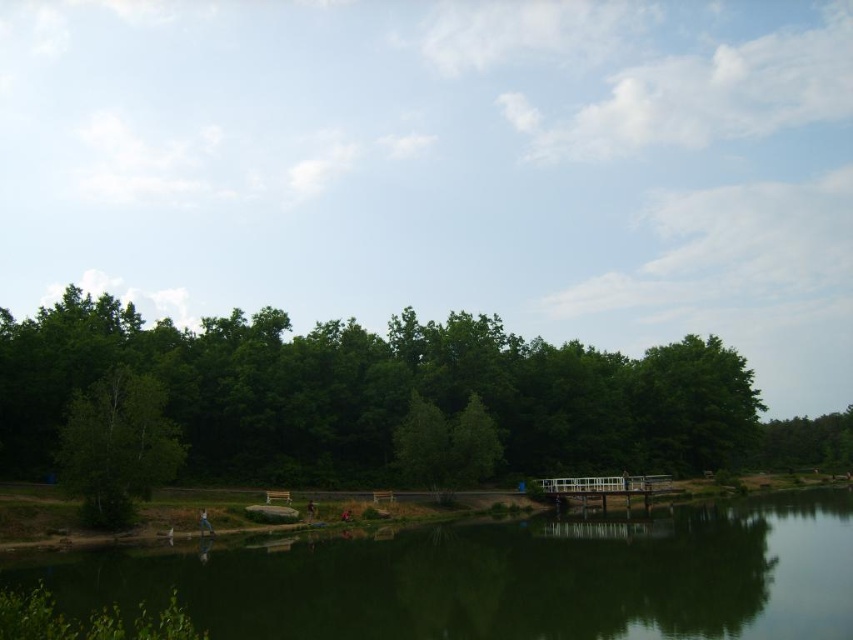
Measure the distance from green leafy trees at center to green matte tree at left.

green leafy trees at center and green matte tree at left are 60.97 feet apart.

What are the coordinates of `green leafy trees at center` in the screenshot? It's located at (396, 396).

Which is in front, point (236, 396) or point (108, 444)?

Point (108, 444) is more forward.

Identify the location of green leafy trees at center. Image resolution: width=853 pixels, height=640 pixels. (396, 396).

Is green reflective water at lower center to the right of green matte tree at left from the viewer's perspective?

Correct, you'll find green reflective water at lower center to the right of green matte tree at left.

In the scene shown: Does green reflective water at lower center appear on the left side of green matte tree at left?

In fact, green reflective water at lower center is to the right of green matte tree at left.

Is point (735, 600) less distant than point (99, 426)?

Yes.

You are a GUI agent. You are given a task and a screenshot of the screen. Output one action in this format:
    pyautogui.click(x=<x>, y=<y>)
    Task: Click on the green reflective water at lower center
    
    Given the screenshot: What is the action you would take?
    pyautogui.click(x=509, y=579)

Where is `green leafy trees at center`? This screenshot has width=853, height=640. green leafy trees at center is located at coordinates (396, 396).